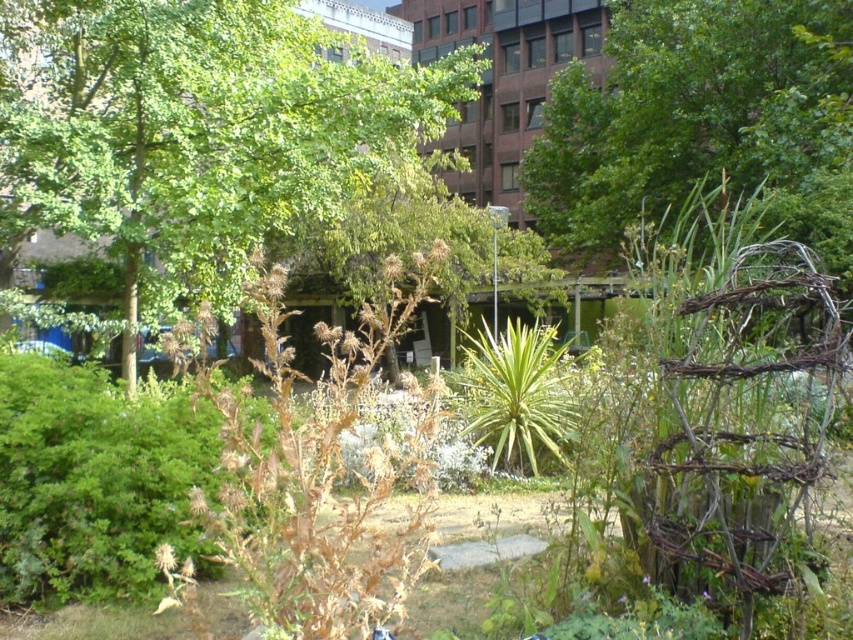
You are standing at the center of the urban garden. You want to take a photo of the green leafy tree at upper right. Which direction should you face to capture it in your camera view?

The green leafy tree at upper right is located at point 0.173 on the x axis and 0.810 on the y axis. Since the coordinates are in the upper right quadrant, you should face towards the upper right direction to capture it in your camera view.